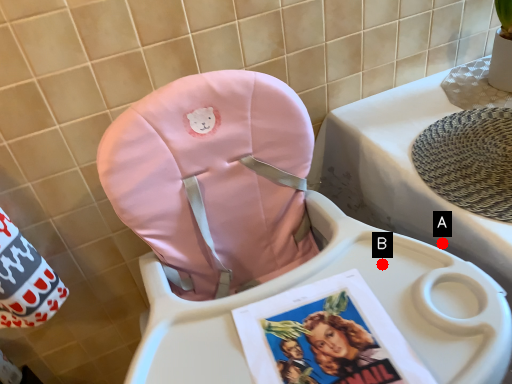
Question: Two points are circled on the image, labeled by A and B beside each circle. Which point is closer to the camera?

Choices:
 (A) A is closer
 (B) B is closer

Answer: (B)